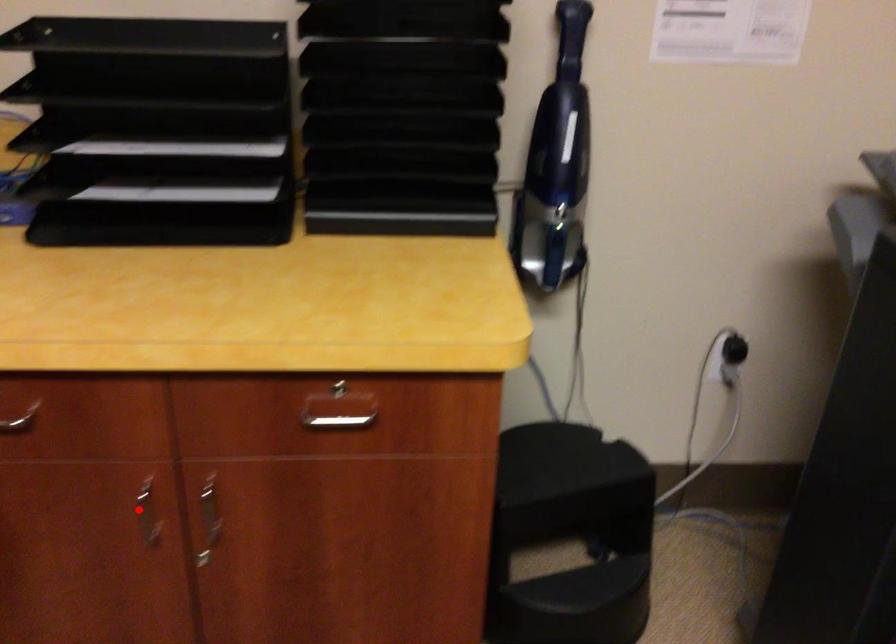
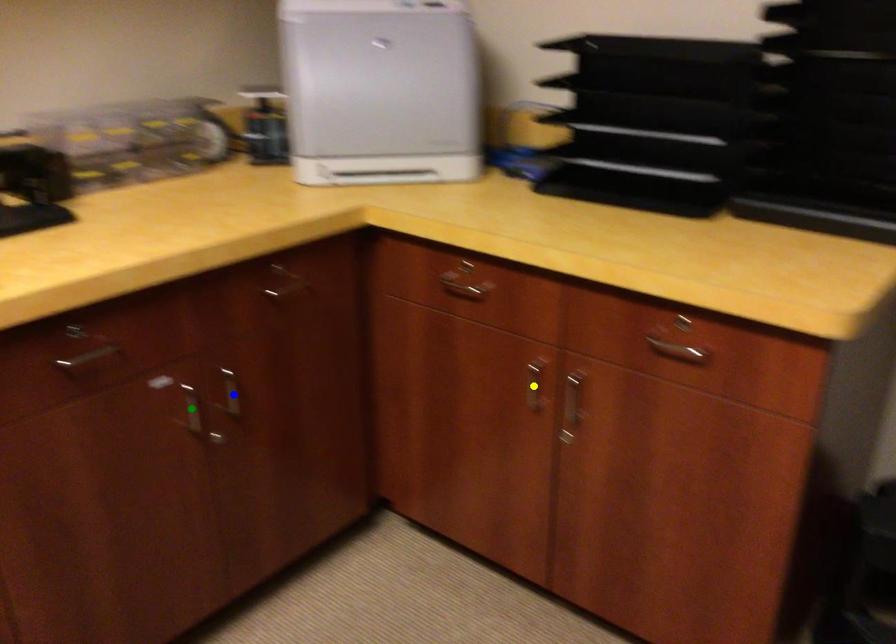
Question: I am providing you with two images of the same scene from different viewpoints. A red point is marked on the first image. You are given multiple points on the second image. Can you choose the point in image 2 that corresponds to the point in image 1?

Choices:
 (A) green point
 (B) yellow point
 (C) blue point

Answer: (B)